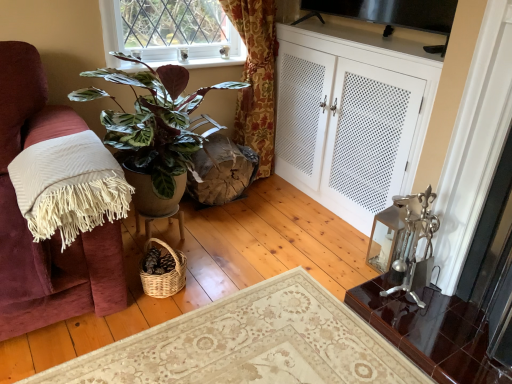
Question: From the image's perspective, is green leafy plant at upper center above white fringed blanket at left?

Choices:
 (A) no
 (B) yes

Answer: (B)

Question: From the image's perspective, is green leafy plant at upper center below white fringed blanket at left?

Choices:
 (A) no
 (B) yes

Answer: (A)

Question: From a real-world perspective, is green leafy plant at upper center on white fringed blanket at left?

Choices:
 (A) yes
 (B) no

Answer: (A)

Question: Is white fringed blanket at left at the back of green leafy plant at upper center?

Choices:
 (A) no
 (B) yes

Answer: (A)

Question: Is green leafy plant at upper center touching white fringed blanket at left?

Choices:
 (A) yes
 (B) no

Answer: (B)

Question: Is matte brown swivel chair at center to the left or to the right of green leafy plant at upper center in the image?

Choices:
 (A) right
 (B) left

Answer: (A)

Question: From the image's perspective, is matte brown swivel chair at center above or below green leafy plant at upper center?

Choices:
 (A) below
 (B) above

Answer: (A)

Question: From a real-world perspective, relative to green leafy plant at upper center, is matte brown swivel chair at center vertically above or below?

Choices:
 (A) above
 (B) below

Answer: (B)

Question: Considering the positions of matte brown swivel chair at center and green leafy plant at upper center in the image, is matte brown swivel chair at center taller or shorter than green leafy plant at upper center?

Choices:
 (A) tall
 (B) short

Answer: (A)

Question: From their relative heights in the image, would you say white fringed blanket at left is taller or shorter than glossy dark brown desk at lower right?

Choices:
 (A) tall
 (B) short

Answer: (A)

Question: From the image's perspective, is white fringed blanket at left located above or below glossy dark brown desk at lower right?

Choices:
 (A) above
 (B) below

Answer: (A)

Question: Is white fringed blanket at left wider or thinner than glossy dark brown desk at lower right?

Choices:
 (A) thin
 (B) wide

Answer: (B)

Question: Is point (50, 180) closer or farther from the camera than point (352, 289)?

Choices:
 (A) closer
 (B) farther

Answer: (A)

Question: In terms of size, does white perforated cabinet at right appear bigger or smaller than green leafy plant at upper center?

Choices:
 (A) small
 (B) big

Answer: (B)

Question: Considering the positions of white perforated cabinet at right and green leafy plant at upper center in the image, is white perforated cabinet at right wider or thinner than green leafy plant at upper center?

Choices:
 (A) wide
 (B) thin

Answer: (A)